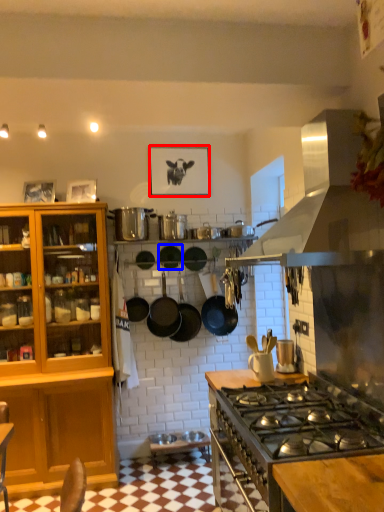
Question: Among these objects, which one is nearest to the camera, picture frame (highlighted by a red box) or frying pan (highlighted by a blue box)?

Choices:
 (A) picture frame
 (B) frying pan

Answer: (B)